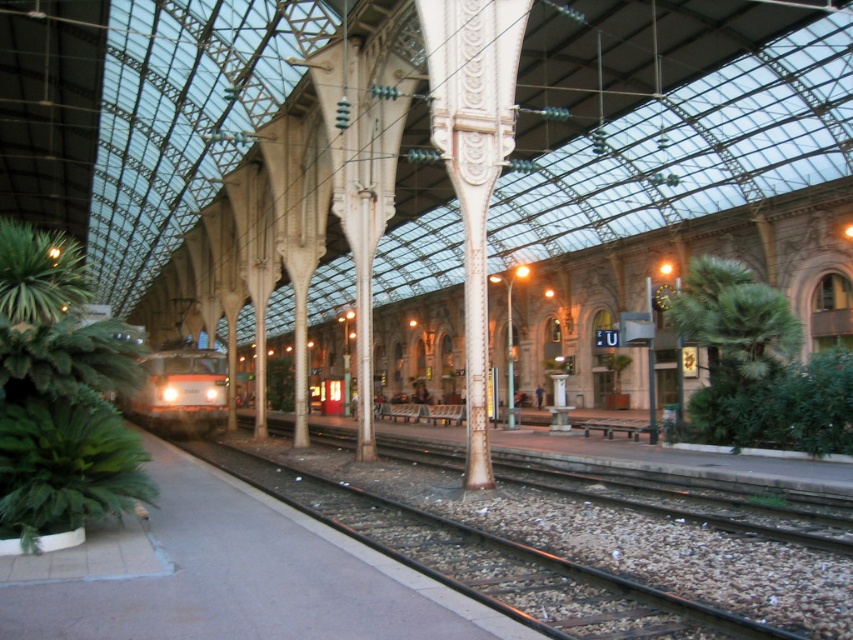
Who is lower down, metal/smooth track at center or green leafy plant at lower left?

Positioned lower is metal/smooth track at center.

Is metal/smooth track at center above green leafy plant at lower left?

Incorrect, metal/smooth track at center is not positioned above green leafy plant at lower left.

Describe the element at coordinates (635, 547) in the screenshot. I see `metal/smooth track at center` at that location.

This screenshot has width=853, height=640. Find the location of `metal/smooth track at center`. metal/smooth track at center is located at coordinates (635, 547).

Does green leafy plant at left have a larger size compared to green leafy plant at lower left?

Indeed, green leafy plant at left has a larger size compared to green leafy plant at lower left.

Locate an element on the screen. The width and height of the screenshot is (853, 640). green leafy plant at left is located at coordinates (61, 394).

At what (x,y) coordinates should I click in order to perform the action: click on green leafy plant at left. Please return your answer as a coordinate pair (x, y). Looking at the image, I should click on (61, 394).

Can you confirm if metal/smooth track at center is positioned to the left of green leafy plant at left?

No, metal/smooth track at center is not to the left of green leafy plant at left.

Measure the distance between metal/smooth track at center and camera.

6.70 meters

What do you see at coordinates (635, 547) in the screenshot?
I see `metal/smooth track at center` at bounding box center [635, 547].

Locate an element on the screen. The width and height of the screenshot is (853, 640). metal/smooth track at center is located at coordinates (635, 547).